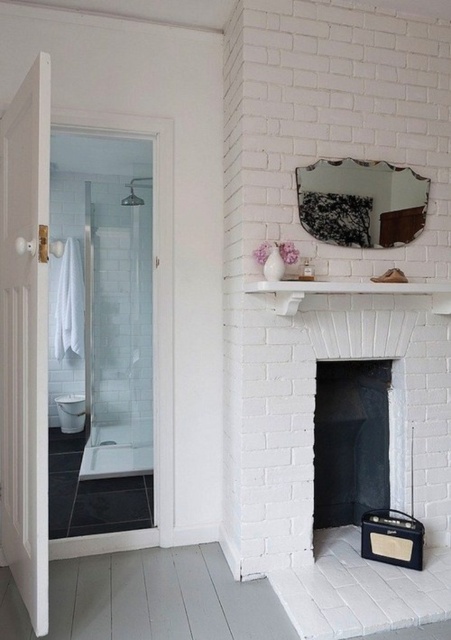
Who is more forward, (92, 444) or (419, 557)?

Point (419, 557) is more forward.

Between point (101, 465) and point (372, 509), which one is positioned behind?

Positioned behind is point (101, 465).

The width and height of the screenshot is (451, 640). I want to click on white glossy bathtub at left, so click(118, 451).

Can you confirm if black matte fireplace at center is bigger than brushed metal shower at upper left?

Yes.

Who is more distant from viewer, (358,502) or (125,205)?

The point (125,205) is behind.

Measure the distance between point (369, 493) and camera.

They are 2.84 meters apart.

The image size is (451, 640). I want to click on black matte fireplace at center, so click(x=349, y=440).

Does white matte shelf at upper center appear on the left side of brushed metal shower at upper left?

No, white matte shelf at upper center is not to the left of brushed metal shower at upper left.

In the scene shown: Can you confirm if white matte shelf at upper center is thinner than brushed metal shower at upper left?

In fact, white matte shelf at upper center might be wider than brushed metal shower at upper left.

Measure the distance between white matte shelf at upper center and camera.

white matte shelf at upper center is 2.22 meters from camera.

In order to click on white matte shelf at upper center in this screenshot , I will do `click(348, 291)`.